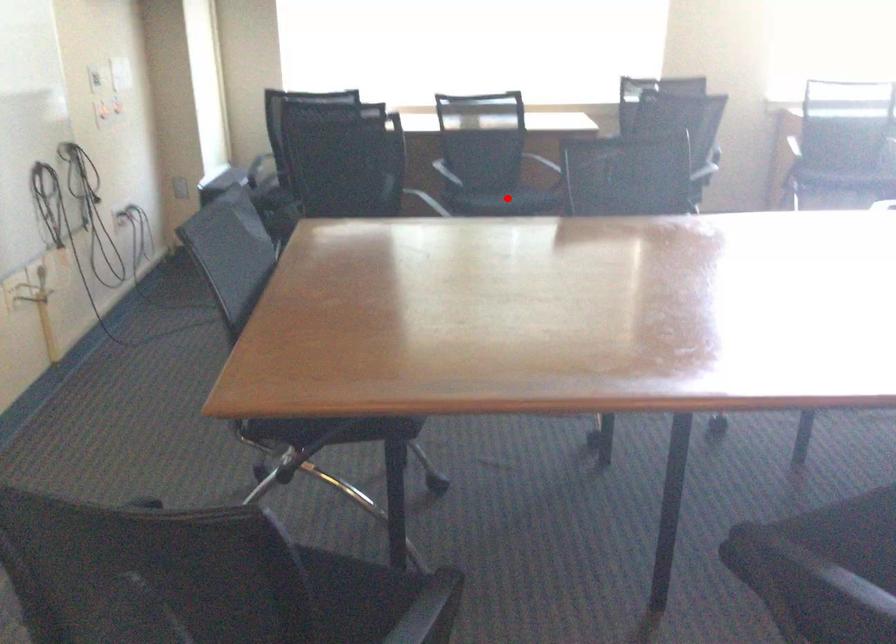
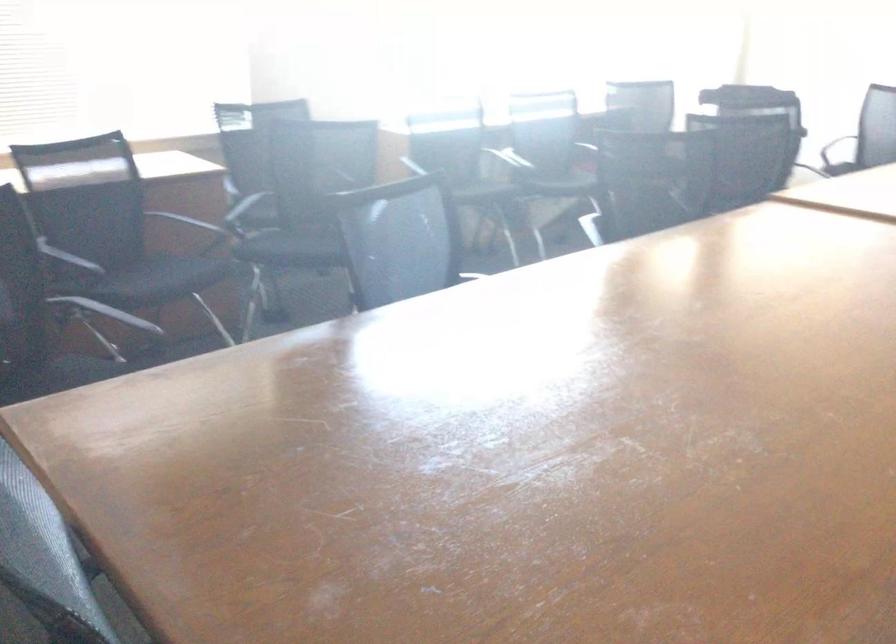
Question: I am providing you with two images of the same scene from different viewpoints. Given a red point in image1, look at the same physical point in image2. Is it:

Choices:
 (A) Closer to the viewpoint
 (B) Farther from the viewpoint

Answer: (A)